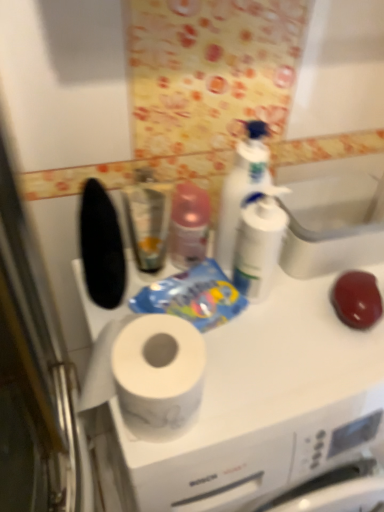
Question: Is white matte countertop at center in front of or behind metallic silver mouthwash at center in the image?

Choices:
 (A) front
 (B) behind

Answer: (A)

Question: Is white matte countertop at center inside or outside of metallic silver mouthwash at center?

Choices:
 (A) outside
 (B) inside

Answer: (A)

Question: Based on their relative distances, which object is nearer to the white plastic pump bottle at center?

Choices:
 (A) metallic silver mouthwash at center
 (B) white matte countertop at center
 (C) white glossy sink at upper center
 (D) white glossy bottle at upper center

Answer: (D)

Question: Estimate the real-world distances between objects in this image. Which object is farther from the white glossy sink at upper center?

Choices:
 (A) white plastic pump bottle at center
 (B) white matte countertop at center
 (C) white glossy bottle at upper center
 (D) metallic silver mouthwash at center

Answer: (B)